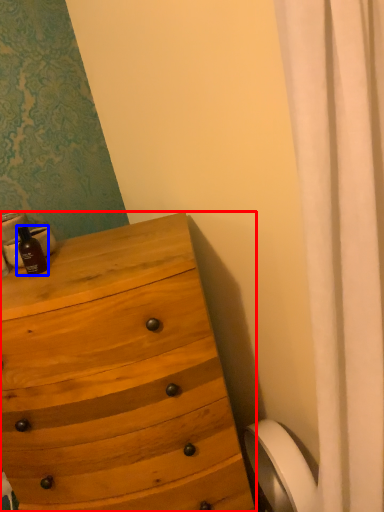
Question: Which object appears farthest to the camera in this image, chest of drawers (highlighted by a red box) or bottle (highlighted by a blue box)?

Choices:
 (A) chest of drawers
 (B) bottle

Answer: (B)